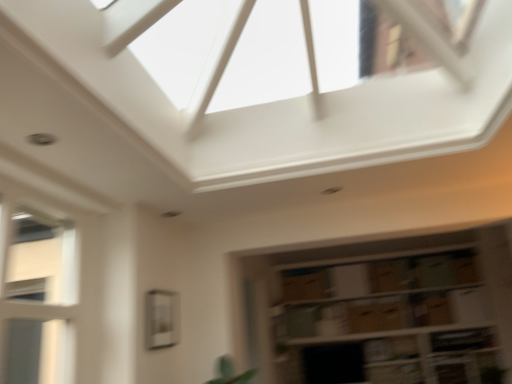
Question: Does clear glass window at center, marked as the second window in a front-to-back arrangement, have a larger size compared to white glass window at left, placed as the first window when sorted from front to back?

Choices:
 (A) yes
 (B) no

Answer: (B)

Question: Is clear glass window at center, which is the second window from left to right, oriented towards white glass window at left, which is counted as the 2th window, starting from the back?

Choices:
 (A) no
 (B) yes

Answer: (A)

Question: From a real-world perspective, is clear glass window at center, the first window from the back, on top of white glass window at left, placed as the first window when sorted from front to back?

Choices:
 (A) no
 (B) yes

Answer: (A)

Question: Can you confirm if clear glass window at center, marked as the second window in a front-to-back arrangement, is thinner than white glass window at left, placed as the first window when sorted from front to back?

Choices:
 (A) yes
 (B) no

Answer: (A)

Question: Does clear glass window at center, which is the second window from left to right, have a lesser height compared to white glass window at left, arranged as the first window when viewed from the left?

Choices:
 (A) yes
 (B) no

Answer: (A)

Question: Choose the correct answer: Is clear glass window at center, which is the second window from left to right, inside white glass window at left, placed as the first window when sorted from front to back, or outside it?

Choices:
 (A) outside
 (B) inside

Answer: (A)

Question: From the image's perspective, is clear glass window at center, which ranks as the first window in right-to-left order, positioned above or below white glass window at left, which is counted as the 2th window, starting from the back?

Choices:
 (A) below
 (B) above

Answer: (A)

Question: Looking at their shapes, would you say clear glass window at center, which ranks as the first window in right-to-left order, is wider or thinner than white glass window at left, arranged as the first window when viewed from the left?

Choices:
 (A) thin
 (B) wide

Answer: (A)

Question: From a real-world perspective, is clear glass window at center, the first window from the back, above or below white glass window at left, which is counted as the 2th window, starting from the back?

Choices:
 (A) above
 (B) below

Answer: (B)

Question: Considering the positions of point (251, 365) and point (70, 264), is point (251, 365) closer or farther from the camera than point (70, 264)?

Choices:
 (A) closer
 (B) farther

Answer: (B)

Question: From a real-world perspective, is brown cardboard boxes at lower right physically located above or below white glass window at left, placed as the first window when sorted from front to back?

Choices:
 (A) above
 (B) below

Answer: (B)

Question: From the image's perspective, is brown cardboard boxes at lower right located above or below white glass window at left, placed as the first window when sorted from front to back?

Choices:
 (A) above
 (B) below

Answer: (B)

Question: Is brown cardboard boxes at lower right in front of or behind white glass window at left, placed as the first window when sorted from front to back, in the image?

Choices:
 (A) front
 (B) behind

Answer: (B)

Question: Considering their positions, is white glass window at left, which is counted as the 2th window, starting from the back, located in front of or behind clear glass window at center, which is the second window from left to right?

Choices:
 (A) front
 (B) behind

Answer: (A)

Question: Looking at the image, does white glass window at left, marked as the second window in a right-to-left arrangement, seem bigger or smaller compared to clear glass window at center, which is the second window from left to right?

Choices:
 (A) big
 (B) small

Answer: (A)